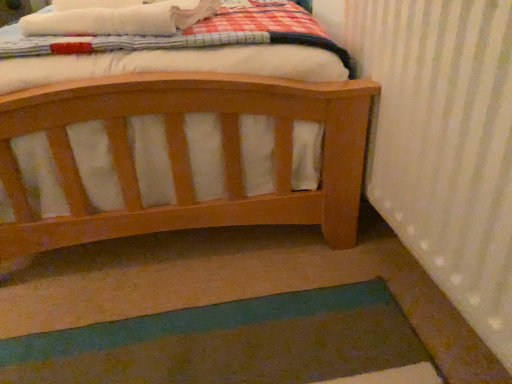
What do you see at coordinates (444, 144) in the screenshot? I see `white textured radiator at right` at bounding box center [444, 144].

At what (x,y) coordinates should I click in order to perform the action: click on white textured radiator at right. Please return your answer as a coordinate pair (x, y). Looking at the image, I should click on 444,144.

Where is `white textured radiator at right`? The width and height of the screenshot is (512, 384). white textured radiator at right is located at coordinates (444, 144).